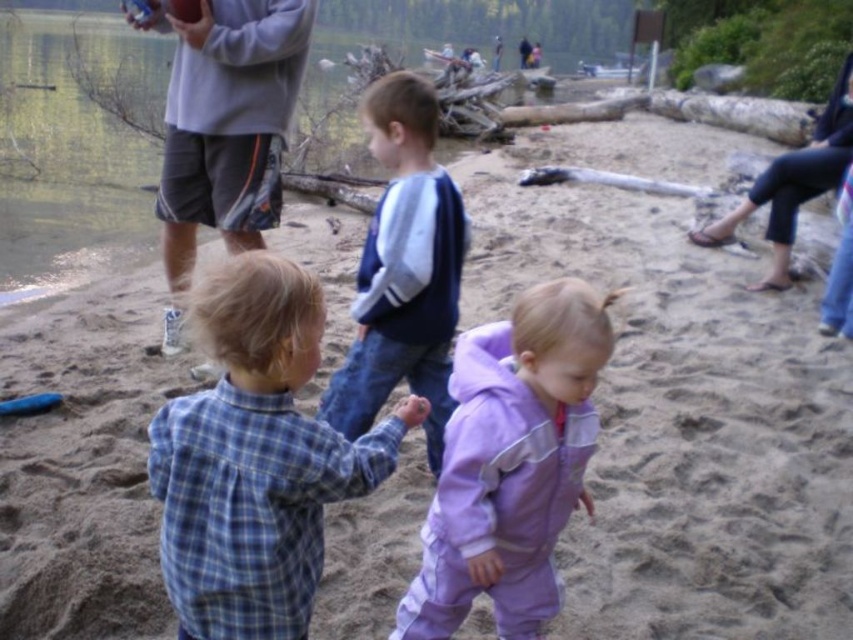
You are a photographer trying to capture a wide shot of the entire lakeside beach scene. You have a camera with a 50mm lens. Knowing that the maximum distance between two subjects in the frame should be within 14 feet for the lens to capture them clearly, can you include both the gray fabric shorts at upper left and the purple fleece jacket at upper right in the same shot?

The gray fabric shorts at upper left and purple fleece jacket at upper right are 13.96 feet apart, which is within the 14 feet limit. Therefore, you can include both in the same shot with the 50mm lens.

You are a photographer trying to capture a group photo of the children. The blue plaid shirt at center and the matte gray water at upper left are in your frame. Considering their sizes, which object would you need to zoom in on more to make them appear equally sized in the photo?

The blue plaid shirt at center is smaller in width than the matte gray water at upper left, so you would need to zoom in more on the blue plaid shirt at center to make it appear the same size as the matte gray water at upper left in the photo.

You are a photographer at the lakeside beach scene. You want to capture a photo that includes both the blue fleece jacket at center and the purple fleece jacket at upper right. Which jacket should you adjust your camera angle to focus on first to ensure both are in frame?

The blue fleece jacket at center is in front of the purple fleece jacket at upper right, so you should focus on the blue fleece jacket at center first to ensure both are visible in the photo.